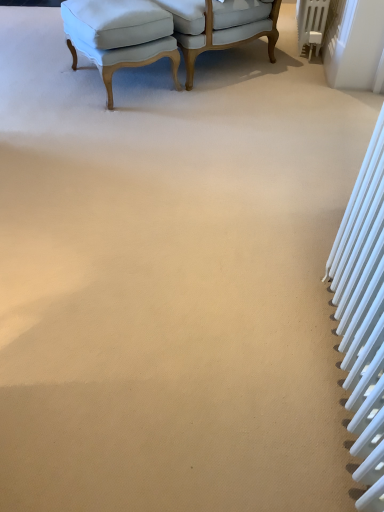
What do you see at coordinates (119, 35) in the screenshot? This screenshot has width=384, height=512. I see `light blue fabric ottoman at upper left, the 1th chair positioned from the left` at bounding box center [119, 35].

This screenshot has width=384, height=512. What are the coordinates of `light blue fabric ottoman at upper left, the 1th chair positioned from the left` in the screenshot? It's located at (119, 35).

The image size is (384, 512). Describe the element at coordinates (220, 26) in the screenshot. I see `light blue fabric chair at upper center, which is counted as the 1th chair, starting from the right` at that location.

Where is `light blue fabric ottoman at upper left, acting as the second chair starting from the right`? The height and width of the screenshot is (512, 384). light blue fabric ottoman at upper left, acting as the second chair starting from the right is located at coordinates (119, 35).

Based on the photo, could you tell me if white metallic radiator at right, positioned as the first radiator in left-to-right order, is facing light blue fabric ottoman at upper left, the 1th chair positioned from the left?

No, white metallic radiator at right, positioned as the first radiator in left-to-right order, does not turn towards light blue fabric ottoman at upper left, the 1th chair positioned from the left.

There is a light blue fabric ottoman at upper left, acting as the second chair starting from the right. Where is `radiator above it (from a real-world perspective)`? The image size is (384, 512). radiator above it (from a real-world perspective) is located at coordinates (363, 316).

Consider the image. In terms of height, does white metallic radiator at right, the first radiator from the bottom, look taller or shorter compared to light blue fabric ottoman at upper left, the 1th chair positioned from the left?

Considering their sizes, white metallic radiator at right, the first radiator from the bottom, has more height than light blue fabric ottoman at upper left, the 1th chair positioned from the left.

Is light blue fabric ottoman at upper left, acting as the second chair starting from the right, wider or thinner than white metallic radiator at right, positioned as the first radiator in left-to-right order?

Considering their sizes, light blue fabric ottoman at upper left, acting as the second chair starting from the right, looks broader than white metallic radiator at right, positioned as the first radiator in left-to-right order.

Is light blue fabric ottoman at upper left, the 1th chair positioned from the left, closer to the viewer compared to white metallic radiator at right, positioned as the 2th radiator in right-to-left order?

That is False.

Is light blue fabric ottoman at upper left, acting as the second chair starting from the right, oriented towards white metallic radiator at right, the 2th radiator from the back?

No, light blue fabric ottoman at upper left, acting as the second chair starting from the right, is not oriented towards white metallic radiator at right, the 2th radiator from the back.

Are white metallic radiator at right, the 2th radiator viewed from the top, and light blue fabric chair at upper center, the second chair from the left, far apart?

Yes, white metallic radiator at right, the 2th radiator viewed from the top, and light blue fabric chair at upper center, the second chair from the left, are located far from each other.

Is light blue fabric chair at upper center, the second chair from the left, at the back of white metallic radiator at right, the 2th radiator from the back?

white metallic radiator at right, the 2th radiator from the back, does not have its back to light blue fabric chair at upper center, the second chair from the left.

From a real-world perspective, is white metallic radiator at right, the 1th radiator from the front, under light blue fabric chair at upper center, the second chair from the left?

No, from a real-world perspective, white metallic radiator at right, the 1th radiator from the front, is not below light blue fabric chair at upper center, the second chair from the left.

Does white metallic radiator at right, the 1th radiator from the front, appear on the left side of white metallic radiator at upper right, the 2th radiator in the bottom-to-top sequence?

Correct, you'll find white metallic radiator at right, the 1th radiator from the front, to the left of white metallic radiator at upper right, the 2th radiator in the bottom-to-top sequence.

From the image's perspective, who appears lower, white metallic radiator at right, the 1th radiator from the front, or white metallic radiator at upper right, which appears as the 1th radiator when viewed from the right?

white metallic radiator at right, the 1th radiator from the front, is shown below in the image.

This screenshot has width=384, height=512. Identify the location of radiator that appears on the right of white metallic radiator at right, the 1th radiator from the front. (311, 23).

Could you tell me if white metallic radiator at upper right, the first radiator from the back, is facing light blue fabric chair at upper center, the second chair from the left?

Yes, white metallic radiator at upper right, the first radiator from the back, faces towards light blue fabric chair at upper center, the second chair from the left.

Considering the relative positions of white metallic radiator at upper right, which appears as the second radiator when viewed from the left, and light blue fabric chair at upper center, the second chair from the left, in the image provided, is white metallic radiator at upper right, which appears as the second radiator when viewed from the left, in front of light blue fabric chair at upper center, the second chair from the left,?

No.

Which of these two, white metallic radiator at upper right, the 2th radiator in the bottom-to-top sequence, or light blue fabric chair at upper center, which is counted as the 1th chair, starting from the right, stands shorter?

Standing shorter between the two is white metallic radiator at upper right, the 2th radiator in the bottom-to-top sequence.

Is white metallic radiator at upper right, arranged as the second radiator when viewed from the front, surrounding light blue fabric chair at upper center, the second chair from the left?

No.

Considering the relative sizes of light blue fabric chair at upper center, which is counted as the 1th chair, starting from the right, and light blue fabric ottoman at upper left, the 1th chair positioned from the left, in the image provided, is light blue fabric chair at upper center, which is counted as the 1th chair, starting from the right, wider than light blue fabric ottoman at upper left, the 1th chair positioned from the left,?

Yes.

Who is taller, light blue fabric chair at upper center, the second chair from the left, or light blue fabric ottoman at upper left, the 1th chair positioned from the left?

With more height is light blue fabric chair at upper center, the second chair from the left.

Is light blue fabric chair at upper center, the second chair from the left, inside or outside of light blue fabric ottoman at upper left, the 1th chair positioned from the left?

light blue fabric chair at upper center, the second chair from the left, lies outside light blue fabric ottoman at upper left, the 1th chair positioned from the left.

What's the angular difference between light blue fabric chair at upper center, the second chair from the left, and light blue fabric ottoman at upper left, acting as the second chair starting from the right,'s facing directions?

light blue fabric chair at upper center, the second chair from the left, and light blue fabric ottoman at upper left, acting as the second chair starting from the right, are facing 177 degrees away from each other.

Is white metallic radiator at upper right, the 2th radiator in the bottom-to-top sequence, completely or partially outside of light blue fabric ottoman at upper left, acting as the second chair starting from the right?

Indeed, white metallic radiator at upper right, the 2th radiator in the bottom-to-top sequence, is completely outside light blue fabric ottoman at upper left, acting as the second chair starting from the right.

Which is more to the left, white metallic radiator at upper right, the 2th radiator in the bottom-to-top sequence, or light blue fabric ottoman at upper left, acting as the second chair starting from the right?

light blue fabric ottoman at upper left, acting as the second chair starting from the right.

Is point (303, 16) positioned before point (70, 39)?

No.

In terms of width, does white metallic radiator at upper right, the first radiator from the back, look wider or thinner when compared to light blue fabric ottoman at upper left, acting as the second chair starting from the right?

Considering their sizes, white metallic radiator at upper right, the first radiator from the back, looks slimmer than light blue fabric ottoman at upper left, acting as the second chair starting from the right.

Starting from the white metallic radiator at right, the first radiator from the bottom, which chair is the 1st one behind? Please provide its 2D coordinates.

[(119, 35)]

This screenshot has width=384, height=512. Identify the location of radiator in front of the light blue fabric ottoman at upper left, acting as the second chair starting from the right. (363, 316).

From the image, which object appears to be nearer to light blue fabric chair at upper center, the second chair from the left, white metallic radiator at upper right, marked as the 1th radiator in a top-to-bottom arrangement, or light blue fabric ottoman at upper left, acting as the second chair starting from the right?

Among the two, light blue fabric ottoman at upper left, acting as the second chair starting from the right, is located nearer to light blue fabric chair at upper center, the second chair from the left.

Considering their positions, is white metallic radiator at right, the first radiator from the bottom, positioned closer to light blue fabric ottoman at upper left, the 1th chair positioned from the left, than white metallic radiator at upper right, marked as the 1th radiator in a top-to-bottom arrangement?

Among the two, white metallic radiator at upper right, marked as the 1th radiator in a top-to-bottom arrangement, is located nearer to light blue fabric ottoman at upper left, the 1th chair positioned from the left.

Based on their spatial positions, is white metallic radiator at right, positioned as the first radiator in left-to-right order, or light blue fabric ottoman at upper left, the 1th chair positioned from the left, further from light blue fabric chair at upper center, which is counted as the 1th chair, starting from the right?

The object further to light blue fabric chair at upper center, which is counted as the 1th chair, starting from the right, is white metallic radiator at right, positioned as the first radiator in left-to-right order.

Looking at the image, which one is located closer to white metallic radiator at upper right, the first radiator from the back, light blue fabric ottoman at upper left, acting as the second chair starting from the right, or light blue fabric chair at upper center, which is counted as the 1th chair, starting from the right?

light blue fabric chair at upper center, which is counted as the 1th chair, starting from the right, lies closer to white metallic radiator at upper right, the first radiator from the back, than the other object.

Considering their positions, is light blue fabric chair at upper center, which is counted as the 1th chair, starting from the right, positioned further to white metallic radiator at upper right, which appears as the 1th radiator when viewed from the right, than white metallic radiator at right, positioned as the first radiator in left-to-right order?

Among the two, white metallic radiator at right, positioned as the first radiator in left-to-right order, is located further to white metallic radiator at upper right, which appears as the 1th radiator when viewed from the right.

Which object lies further to the anchor point light blue fabric ottoman at upper left, acting as the second chair starting from the right, white metallic radiator at upper right, which appears as the 1th radiator when viewed from the right, or light blue fabric chair at upper center, which is counted as the 1th chair, starting from the right?

white metallic radiator at upper right, which appears as the 1th radiator when viewed from the right.

Considering their positions, is light blue fabric ottoman at upper left, the 1th chair positioned from the left, positioned further to light blue fabric chair at upper center, which is counted as the 1th chair, starting from the right, than white metallic radiator at upper right, which appears as the 1th radiator when viewed from the right?

white metallic radiator at upper right, which appears as the 1th radiator when viewed from the right, is positioned further to the anchor light blue fabric chair at upper center, which is counted as the 1th chair, starting from the right.

Considering their positions, is light blue fabric chair at upper center, the second chair from the left, positioned closer to white metallic radiator at upper right, which appears as the 1th radiator when viewed from the right, than light blue fabric ottoman at upper left, the 1th chair positioned from the left?

Based on the image, light blue fabric chair at upper center, the second chair from the left, appears to be nearer to white metallic radiator at upper right, which appears as the 1th radiator when viewed from the right.

Where is `chair positioned between white metallic radiator at right, the first radiator from the bottom, and light blue fabric chair at upper center, the second chair from the left, from near to far`? The width and height of the screenshot is (384, 512). chair positioned between white metallic radiator at right, the first radiator from the bottom, and light blue fabric chair at upper center, the second chair from the left, from near to far is located at coordinates (119, 35).

What are the coordinates of `chair between light blue fabric ottoman at upper left, the 1th chair positioned from the left, and white metallic radiator at upper right, which appears as the 1th radiator when viewed from the right` in the screenshot? It's located at click(x=220, y=26).